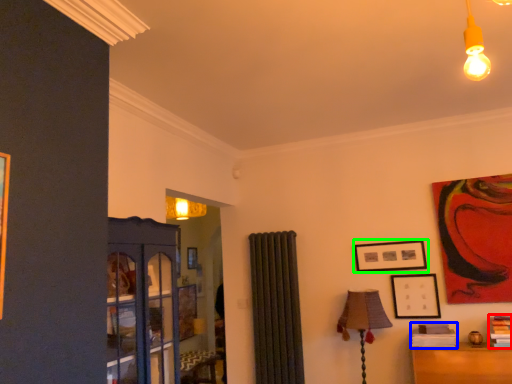
Question: Estimate the real-world distances between objects in this image. Which object is farther from book (highlighted by a red box), book (highlighted by a blue box) or picture frame (highlighted by a green box)?

Choices:
 (A) book
 (B) picture frame

Answer: (B)